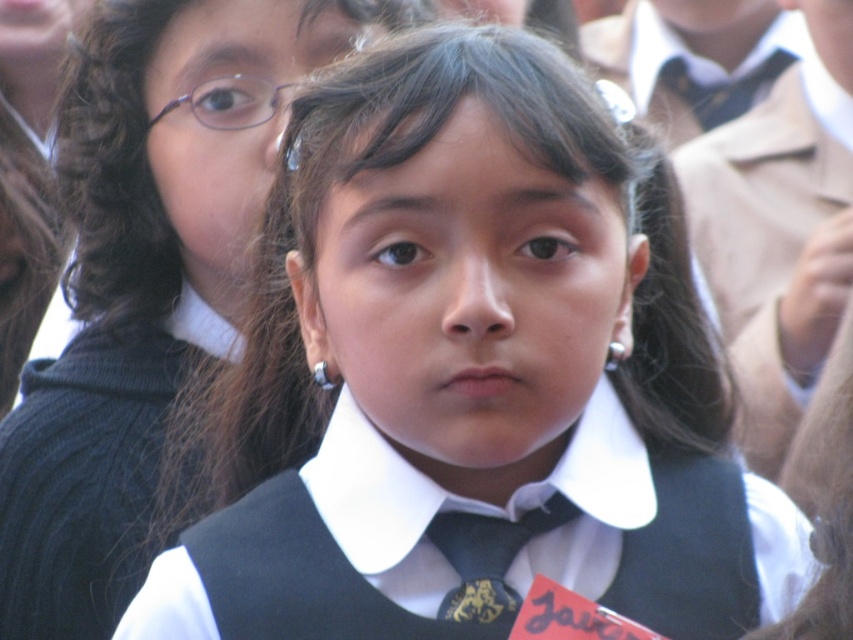
You are standing at the origin of a coordinate system placed at the bottom left corner of the image. There are two points marked in the image. One is at point (117,321) and the other is at point (447,618). Which point is closer to the bottom edge of the image?

Point (117,321) is closer to the bottom edge of the image because its y coordinate is smaller than that of point (447,618).